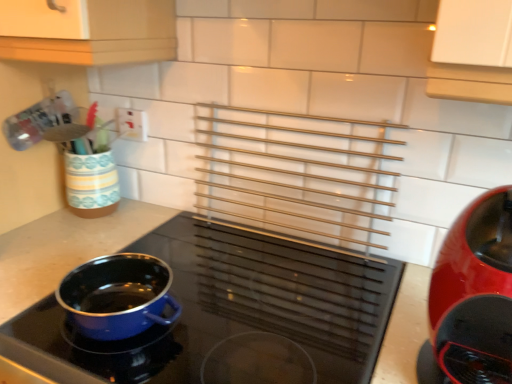
What do you see at coordinates (227, 309) in the screenshot?
I see `blue enamel pot at center-left, placed as the first kitchen appliance when sorted from left to right` at bounding box center [227, 309].

Where is `white plastic electric outlet at upper left`? The height and width of the screenshot is (384, 512). white plastic electric outlet at upper left is located at coordinates (131, 124).

Could you tell me if blue enamel pot at center-left, placed as the first kitchen appliance when sorted from left to right, is facing glossy plastic coffee maker at right, which ranks as the second kitchen appliance in left-to-right order?

No, blue enamel pot at center-left, placed as the first kitchen appliance when sorted from left to right, is not oriented towards glossy plastic coffee maker at right, which ranks as the second kitchen appliance in left-to-right order.

In the scene shown: From a real-world perspective, is blue enamel pot at center-left, which is the 2th kitchen appliance in right-to-left order, positioned over glossy plastic coffee maker at right, positioned as the 1th kitchen appliance in right-to-left order, based on gravity?

No, from a real-world perspective, blue enamel pot at center-left, which is the 2th kitchen appliance in right-to-left order, is not on top of glossy plastic coffee maker at right, positioned as the 1th kitchen appliance in right-to-left order.

Can you confirm if blue enamel pot at center-left, which is the 2th kitchen appliance in right-to-left order, is thinner than glossy plastic coffee maker at right, positioned as the 1th kitchen appliance in right-to-left order?

Incorrect, the width of blue enamel pot at center-left, which is the 2th kitchen appliance in right-to-left order, is not less than that of glossy plastic coffee maker at right, positioned as the 1th kitchen appliance in right-to-left order.

Considering the positions of objects blue enamel pot at center-left, which is the 2th kitchen appliance in right-to-left order, and glossy plastic coffee maker at right, which ranks as the second kitchen appliance in left-to-right order, in the image provided, who is more to the right, blue enamel pot at center-left, which is the 2th kitchen appliance in right-to-left order, or glossy plastic coffee maker at right, which ranks as the second kitchen appliance in left-to-right order,?

From the viewer's perspective, glossy plastic coffee maker at right, which ranks as the second kitchen appliance in left-to-right order, appears more on the right side.

Where is `electric outlet on the left of glossy plastic coffee maker at right, which ranks as the second kitchen appliance in left-to-right order`? This screenshot has height=384, width=512. electric outlet on the left of glossy plastic coffee maker at right, which ranks as the second kitchen appliance in left-to-right order is located at coordinates (131, 124).

From the image's perspective, is white plastic electric outlet at upper left below glossy plastic coffee maker at right, positioned as the 1th kitchen appliance in right-to-left order?

No, from the image's perspective, white plastic electric outlet at upper left is not below glossy plastic coffee maker at right, positioned as the 1th kitchen appliance in right-to-left order.

Considering the relative positions of white plastic electric outlet at upper left and glossy plastic coffee maker at right, positioned as the 1th kitchen appliance in right-to-left order, in the image provided, is white plastic electric outlet at upper left to the right of glossy plastic coffee maker at right, positioned as the 1th kitchen appliance in right-to-left order, from the viewer's perspective?

No.

What's the angular difference between white plastic electric outlet at upper left and glossy plastic coffee maker at right, positioned as the 1th kitchen appliance in right-to-left order,'s facing directions?

They differ by 0.0155 degrees in their facing directions.

From a real-world perspective, is glossy plastic coffee maker at right, positioned as the 1th kitchen appliance in right-to-left order, above or below blue enamel pot at center-left, placed as the first kitchen appliance when sorted from left to right?

From a real-world perspective, glossy plastic coffee maker at right, positioned as the 1th kitchen appliance in right-to-left order, is physically above blue enamel pot at center-left, placed as the first kitchen appliance when sorted from left to right.

From the image's perspective, would you say glossy plastic coffee maker at right, positioned as the 1th kitchen appliance in right-to-left order, is positioned over blue enamel pot at center-left, which is the 2th kitchen appliance in right-to-left order?

Indeed, from the image's perspective, glossy plastic coffee maker at right, positioned as the 1th kitchen appliance in right-to-left order, is shown above blue enamel pot at center-left, which is the 2th kitchen appliance in right-to-left order.

What's the angular difference between glossy plastic coffee maker at right, which ranks as the second kitchen appliance in left-to-right order, and blue enamel pot at center-left, which is the 2th kitchen appliance in right-to-left order,'s facing directions?

glossy plastic coffee maker at right, which ranks as the second kitchen appliance in left-to-right order, and blue enamel pot at center-left, which is the 2th kitchen appliance in right-to-left order, are facing 0.000428 degrees away from each other.

From the image's perspective, is white plastic electric outlet at upper left above blue enamel pot at center-left, which is the 2th kitchen appliance in right-to-left order?

Answer: Yes, from the image's perspective, white plastic electric outlet at upper left is above blue enamel pot at center-left, which is the 2th kitchen appliance in right-to-left order.

Is white plastic electric outlet at upper left facing away from blue enamel pot at center-left, placed as the first kitchen appliance when sorted from left to right?

No.

Considering the sizes of objects white plastic electric outlet at upper left and blue enamel pot at center-left, which is the 2th kitchen appliance in right-to-left order, in the image provided, who is taller, white plastic electric outlet at upper left or blue enamel pot at center-left, which is the 2th kitchen appliance in right-to-left order,?

blue enamel pot at center-left, which is the 2th kitchen appliance in right-to-left order, is taller.

Is white plastic electric outlet at upper left far away from blue enamel pot at center-left, which is the 2th kitchen appliance in right-to-left order?

No, white plastic electric outlet at upper left is not far away from blue enamel pot at center-left, which is the 2th kitchen appliance in right-to-left order.

Is glossy plastic coffee maker at right, which ranks as the second kitchen appliance in left-to-right order, positioned far away from white plastic electric outlet at upper left?

No, glossy plastic coffee maker at right, which ranks as the second kitchen appliance in left-to-right order, is in close proximity to white plastic electric outlet at upper left.

Considering the relative sizes of glossy plastic coffee maker at right, which ranks as the second kitchen appliance in left-to-right order, and white plastic electric outlet at upper left in the image provided, is glossy plastic coffee maker at right, which ranks as the second kitchen appliance in left-to-right order, wider than white plastic electric outlet at upper left?

Yes, glossy plastic coffee maker at right, which ranks as the second kitchen appliance in left-to-right order, is wider than white plastic electric outlet at upper left.

Which is more to the left, glossy plastic coffee maker at right, positioned as the 1th kitchen appliance in right-to-left order, or white plastic electric outlet at upper left?

From the viewer's perspective, white plastic electric outlet at upper left appears more on the left side.

Can you confirm if glossy plastic coffee maker at right, positioned as the 1th kitchen appliance in right-to-left order, is smaller than white plastic electric outlet at upper left?

Incorrect, glossy plastic coffee maker at right, positioned as the 1th kitchen appliance in right-to-left order, is not smaller in size than white plastic electric outlet at upper left.

Considering their positions, is blue enamel pot at center-left, placed as the first kitchen appliance when sorted from left to right, located in front of or behind white plastic electric outlet at upper left?

In the image, blue enamel pot at center-left, placed as the first kitchen appliance when sorted from left to right, appears in front of white plastic electric outlet at upper left.

Is blue enamel pot at center-left, which is the 2th kitchen appliance in right-to-left order, in contact with white plastic electric outlet at upper left?

blue enamel pot at center-left, which is the 2th kitchen appliance in right-to-left order, is not next to white plastic electric outlet at upper left, and they're not touching.

Which of these two, blue enamel pot at center-left, which is the 2th kitchen appliance in right-to-left order, or white plastic electric outlet at upper left, is wider?

With larger width is blue enamel pot at center-left, which is the 2th kitchen appliance in right-to-left order.

The height and width of the screenshot is (384, 512). I want to click on kitchen appliance above the blue enamel pot at center-left, which is the 2th kitchen appliance in right-to-left order (from a real-world perspective), so click(x=472, y=298).

The image size is (512, 384). In order to click on electric outlet located on the left of glossy plastic coffee maker at right, positioned as the 1th kitchen appliance in right-to-left order in this screenshot , I will do `click(131, 124)`.

Considering their positions, is white plastic electric outlet at upper left positioned closer to glossy plastic coffee maker at right, positioned as the 1th kitchen appliance in right-to-left order, than blue enamel pot at center-left, placed as the first kitchen appliance when sorted from left to right?

blue enamel pot at center-left, placed as the first kitchen appliance when sorted from left to right, is positioned closer to the anchor glossy plastic coffee maker at right, positioned as the 1th kitchen appliance in right-to-left order.

Considering their positions, is blue enamel pot at center-left, which is the 2th kitchen appliance in right-to-left order, positioned further to white plastic electric outlet at upper left than glossy plastic coffee maker at right, positioned as the 1th kitchen appliance in right-to-left order?

The object further to white plastic electric outlet at upper left is glossy plastic coffee maker at right, positioned as the 1th kitchen appliance in right-to-left order.

When comparing their distances from blue enamel pot at center-left, placed as the first kitchen appliance when sorted from left to right, does glossy plastic coffee maker at right, which ranks as the second kitchen appliance in left-to-right order, or white plastic electric outlet at upper left seem further?

white plastic electric outlet at upper left is further to blue enamel pot at center-left, placed as the first kitchen appliance when sorted from left to right.

From the image, which object appears to be nearer to blue enamel pot at center-left, which is the 2th kitchen appliance in right-to-left order, white plastic electric outlet at upper left or glossy plastic coffee maker at right, positioned as the 1th kitchen appliance in right-to-left order?

glossy plastic coffee maker at right, positioned as the 1th kitchen appliance in right-to-left order, is closer to blue enamel pot at center-left, which is the 2th kitchen appliance in right-to-left order.

Considering their positions, is blue enamel pot at center-left, placed as the first kitchen appliance when sorted from left to right, positioned further to glossy plastic coffee maker at right, positioned as the 1th kitchen appliance in right-to-left order, than white plastic electric outlet at upper left?

white plastic electric outlet at upper left is further to glossy plastic coffee maker at right, positioned as the 1th kitchen appliance in right-to-left order.

Estimate the real-world distances between objects in this image. Which object is further from white plastic electric outlet at upper left, glossy plastic coffee maker at right, which ranks as the second kitchen appliance in left-to-right order, or blue enamel pot at center-left, placed as the first kitchen appliance when sorted from left to right?

glossy plastic coffee maker at right, which ranks as the second kitchen appliance in left-to-right order, is positioned further to the anchor white plastic electric outlet at upper left.

This screenshot has height=384, width=512. In order to click on kitchen appliance between blue enamel pot at center-left, which is the 2th kitchen appliance in right-to-left order, and white plastic electric outlet at upper left from front to back in this screenshot , I will do `click(472, 298)`.